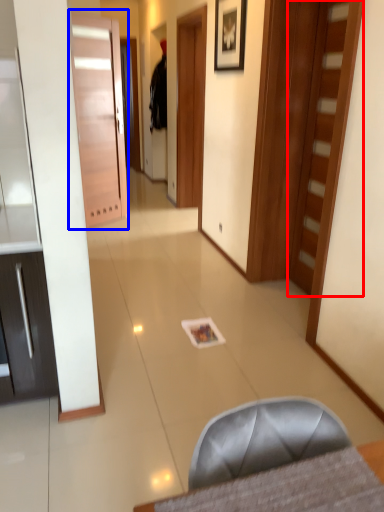
Question: Which object appears closest to the camera in this image, door (highlighted by a red box) or door (highlighted by a blue box)?

Choices:
 (A) door
 (B) door

Answer: (A)